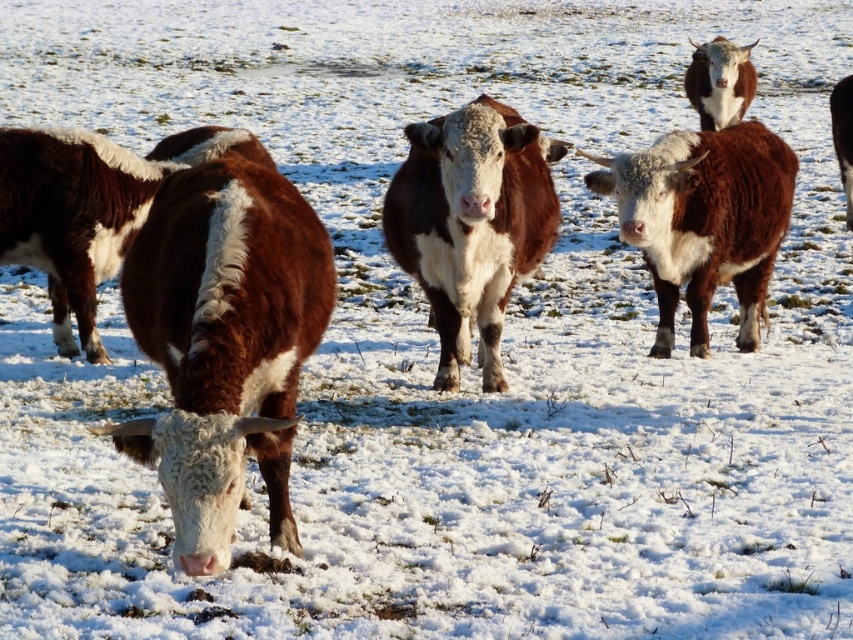
Can you confirm if brown/white fur at center is thinner than brown furry cow at center?

Yes.

The height and width of the screenshot is (640, 853). I want to click on brown/white fur at center, so click(224, 340).

Is point (456, 189) in front of point (80, 298)?

Yes, point (456, 189) is in front of point (80, 298).

Does brown/white textured cow at center have a smaller size compared to brown fuzzy cow at left?

No, brown/white textured cow at center is not smaller than brown fuzzy cow at left.

Is point (445, 346) closer to viewer compared to point (12, 230)?

Yes, point (445, 346) is closer to viewer.

Find the location of a particular element. Image resolution: width=853 pixels, height=640 pixels. brown/white textured cow at center is located at coordinates (473, 224).

Is brown furry cow at center in front of brown fuzzy cow at left?

Yes, brown furry cow at center is closer to the viewer.

This screenshot has width=853, height=640. Describe the element at coordinates (703, 220) in the screenshot. I see `brown furry cow at center` at that location.

Locate an element on the screen. The height and width of the screenshot is (640, 853). brown furry cow at center is located at coordinates (703, 220).

I want to click on brown furry cow at center, so click(703, 220).